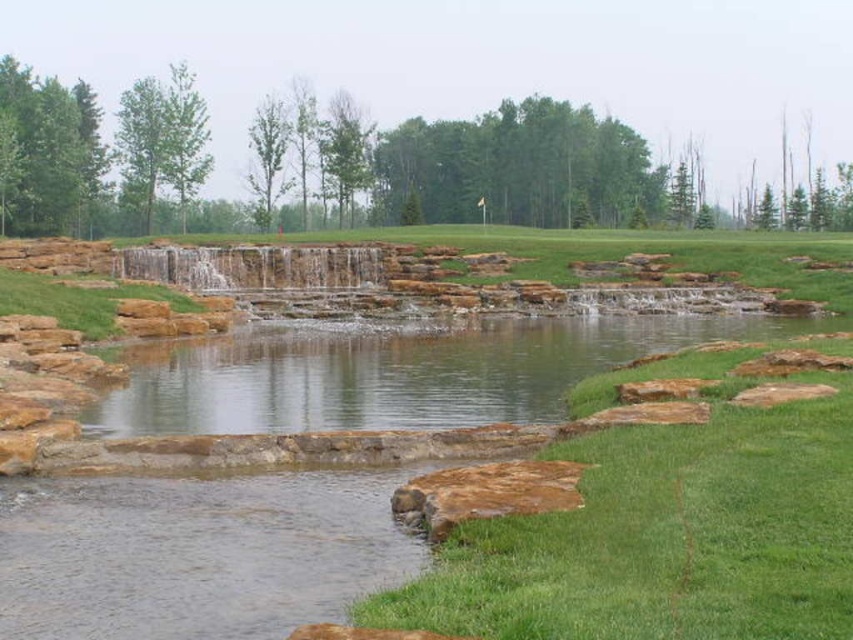
Question: Among these points, which one is farthest from the camera?

Choices:
 (A) (213, 426)
 (B) (753, 564)

Answer: (A)

Question: Which point appears farthest from the camera in this image?

Choices:
 (A) (274, 336)
 (B) (706, 525)

Answer: (A)

Question: In this image, where is green grass at lower center located relative to clear water at center?

Choices:
 (A) right
 (B) left

Answer: (A)

Question: Which point appears closest to the camera in this image?

Choices:
 (A) (579, 579)
 (B) (680, 332)

Answer: (A)

Question: Can you confirm if green grass at lower center is positioned to the left of clear water at center?

Choices:
 (A) yes
 (B) no

Answer: (B)

Question: Does green grass at lower center appear on the left side of clear water at center?

Choices:
 (A) yes
 (B) no

Answer: (B)